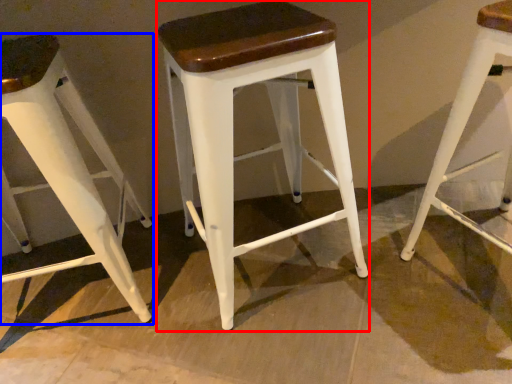
Question: Among these objects, which one is farthest to the camera, stool (highlighted by a red box) or stool (highlighted by a blue box)?

Choices:
 (A) stool
 (B) stool

Answer: (B)